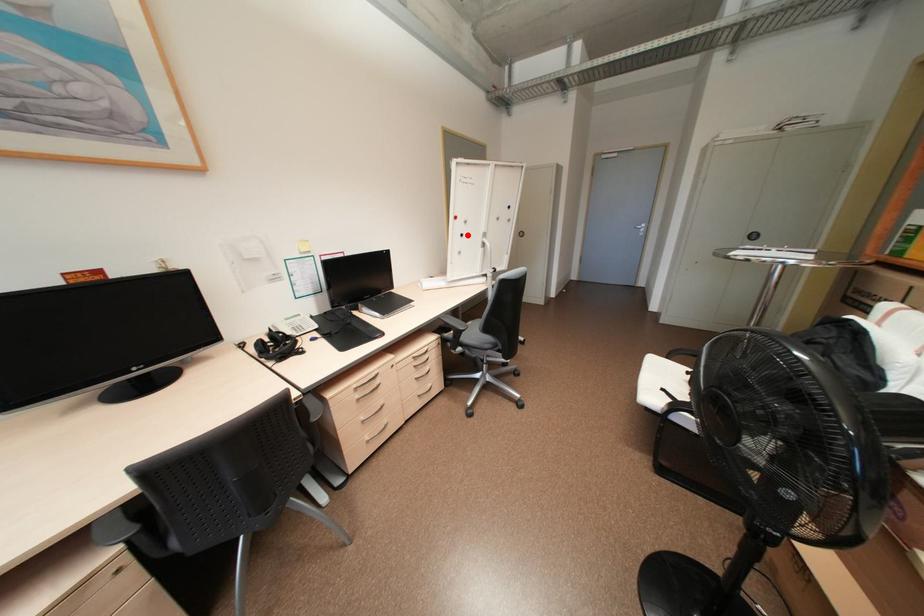
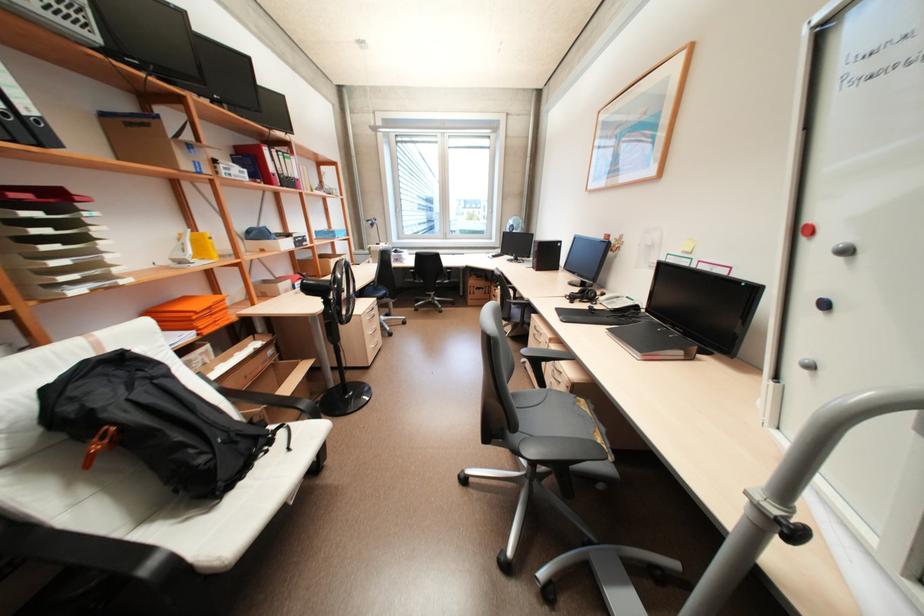
Locate, in the second image, the point that corresponds to the highlighted location in the first image.

(830, 304)